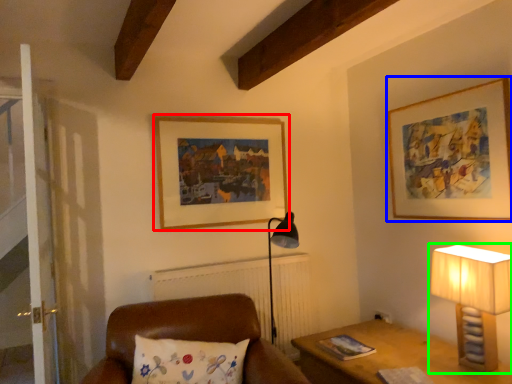
Question: Estimate the real-world distances between objects in this image. Which object is closer to picture frame (highlighted by a red box), picture frame (highlighted by a blue box) or lamp (highlighted by a green box)?

Choices:
 (A) picture frame
 (B) lamp

Answer: (A)